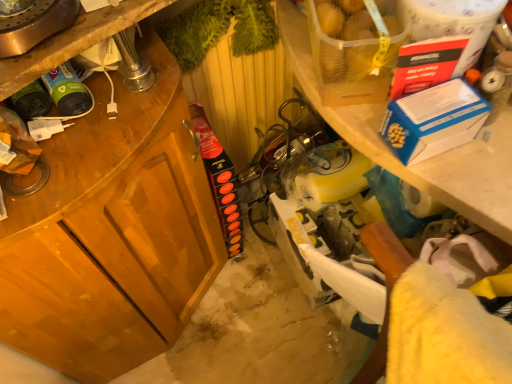
What are the coordinates of `blank space situated above wooden cabinet at left (from a real-world perspective)` in the screenshot? It's located at (92, 132).